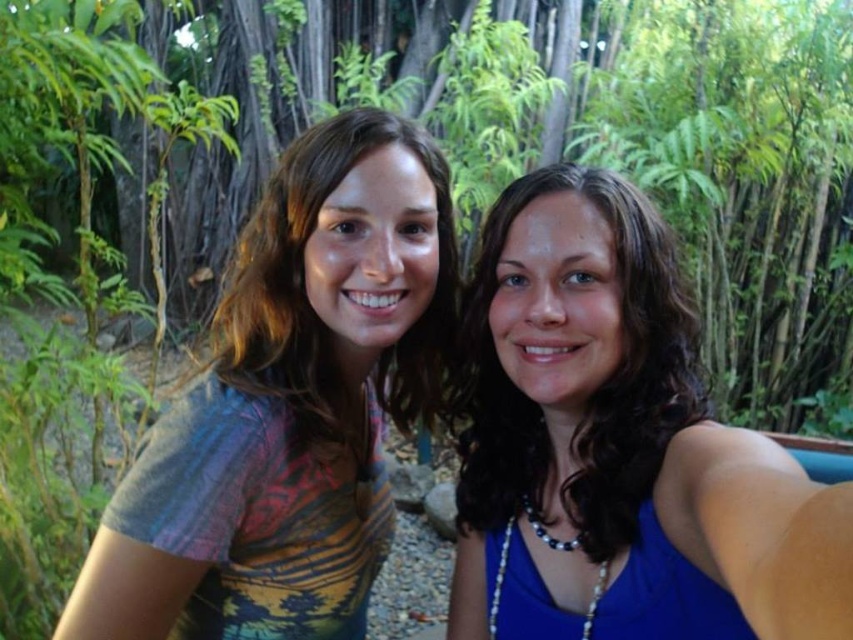
You are trying to take a selfie with the green leafy tree at center and the multicolored fabric shirt at left in the frame. Which object should you position closer to the camera to ensure both are fully visible in the photo?

You should position the multicolored fabric shirt at left closer to the camera because the green leafy tree at center is wider than the multicolored fabric shirt at left, so bringing the shirt forward will help fit both into the frame.

You are a photographer trying to capture a clear shot of the blue silk tank top at center. The green leafy tree at center is blocking your view. Can you adjust your angle to avoid the tree while still keeping the tank top in frame?

The green leafy tree at center is positioned over the blue silk tank top at center, so adjusting the angle downward might allow you to capture the tank top without the tree blocking the view.